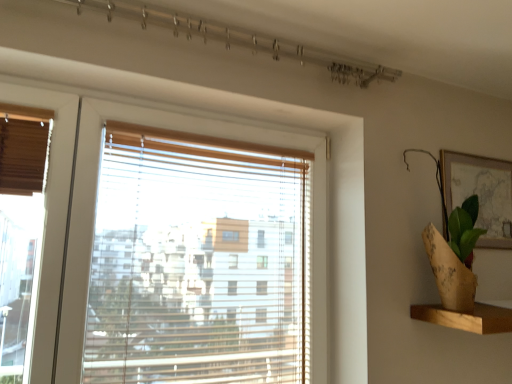
What do you see at coordinates (457, 219) in the screenshot?
I see `burlap wrapped plant at right` at bounding box center [457, 219].

What do you see at coordinates (313, 224) in the screenshot? I see `transparent plastic blinds at center` at bounding box center [313, 224].

Where is `transparent plastic blinds at center`? transparent plastic blinds at center is located at coordinates click(x=313, y=224).

Find the location of `wooden at right`. wooden at right is located at coordinates (468, 317).

Does matte gold picture frame at upper right turn towards wooden at right?

No.

Is the surface of matte gold picture frame at upper right in direct contact with wooden at right?

No, matte gold picture frame at upper right is not in contact with wooden at right.

Considering the sizes of objects matte gold picture frame at upper right and wooden at right in the image provided, who is bigger, matte gold picture frame at upper right or wooden at right?

Bigger between the two is wooden at right.

Which of these two, matte gold picture frame at upper right or wooden at right, is wider?

With larger width is wooden at right.

Is wooden at right further to the viewer compared to transparent plastic blinds at center?

Yes, wooden at right is further from the viewer.

Which is more to the left, wooden at right or transparent plastic blinds at center?

From the viewer's perspective, transparent plastic blinds at center appears more on the left side.

Considering the relative sizes of wooden at right and transparent plastic blinds at center in the image provided, is wooden at right smaller than transparent plastic blinds at center?

Yes, wooden at right is smaller than transparent plastic blinds at center.

Is burlap wrapped plant at right directly adjacent to wooden at right?

They are not placed beside each other.

Between point (475, 228) and point (457, 321), which one is positioned in front?

The point (457, 321) is more forward.

Considering the positions of objects burlap wrapped plant at right and wooden at right in the image provided, who is in front, burlap wrapped plant at right or wooden at right?

burlap wrapped plant at right.

How many degrees apart are the facing directions of burlap wrapped plant at right and wooden at right?

The angle between the facing direction of burlap wrapped plant at right and the facing direction of wooden at right is 0.0556 degrees.

Does transparent plastic blinds at center appear on the left side of wooden at right?

Yes, transparent plastic blinds at center is to the left of wooden at right.

Is transparent plastic blinds at center turned away from wooden at right?

No, transparent plastic blinds at center is not facing away from wooden at right.

Is the position of transparent plastic blinds at center more distant than that of wooden at right?

No, transparent plastic blinds at center is in front of wooden at right.

From a real-world perspective, who is located lower, transparent plastic blinds at center or wooden at right?

wooden at right.

Is matte gold picture frame at upper right far from transparent plastic blinds at center?

Actually, matte gold picture frame at upper right and transparent plastic blinds at center are a little close together.

Choose the correct answer: Is matte gold picture frame at upper right inside transparent plastic blinds at center or outside it?

The correct answer is: outside.

Considering the sizes of objects matte gold picture frame at upper right and transparent plastic blinds at center in the image provided, who is taller, matte gold picture frame at upper right or transparent plastic blinds at center?

With more height is transparent plastic blinds at center.

From a real-world perspective, between transparent plastic blinds at center and matte gold picture frame at upper right, who is vertically lower?

transparent plastic blinds at center.

Which is closer, (86, 253) or (475, 159)?

Point (86, 253) is positioned closer to the camera compared to point (475, 159).

How much distance is there between transparent plastic blinds at center and matte gold picture frame at upper right?

A distance of 27.99 inches exists between transparent plastic blinds at center and matte gold picture frame at upper right.

Where is `picture frame that appears above the transparent plastic blinds at center (from the image's perspective)`? The image size is (512, 384). picture frame that appears above the transparent plastic blinds at center (from the image's perspective) is located at coordinates coord(481,193).

Between burlap wrapped plant at right and matte gold picture frame at upper right, which one appears on the left side from the viewer's perspective?

From the viewer's perspective, burlap wrapped plant at right appears more on the left side.

Considering their positions, is burlap wrapped plant at right located in front of or behind matte gold picture frame at upper right?

Visually, burlap wrapped plant at right is located in front of matte gold picture frame at upper right.

Which is closer, (452,221) or (449,179)?

Point (452,221).

Based on the photo, from a real-world perspective, who is located higher, burlap wrapped plant at right or matte gold picture frame at upper right?

matte gold picture frame at upper right.

Where is `shelf on the left of the matte gold picture frame at upper right`? shelf on the left of the matte gold picture frame at upper right is located at coordinates (468, 317).

Locate an element on the screen. The image size is (512, 384). shelf below the transparent plastic blinds at center (from the image's perspective) is located at coordinates (468, 317).

Which object lies nearer to the anchor point wooden at right, burlap wrapped plant at right or transparent plastic blinds at center?

Based on the image, burlap wrapped plant at right appears to be nearer to wooden at right.

Looking at the image, which one is located further to wooden at right, transparent plastic blinds at center or matte gold picture frame at upper right?

transparent plastic blinds at center lies further to wooden at right than the other object.

From the image, which object appears to be nearer to matte gold picture frame at upper right, wooden at right or transparent plastic blinds at center?

wooden at right lies closer to matte gold picture frame at upper right than the other object.

From the picture: Which object lies nearer to the anchor point transparent plastic blinds at center, burlap wrapped plant at right or matte gold picture frame at upper right?

burlap wrapped plant at right lies closer to transparent plastic blinds at center than the other object.

From the image, which object appears to be farther from transparent plastic blinds at center, wooden at right or matte gold picture frame at upper right?

Based on the image, matte gold picture frame at upper right appears to be further to transparent plastic blinds at center.

Looking at this image, when comparing their distances from matte gold picture frame at upper right, does burlap wrapped plant at right or transparent plastic blinds at center seem further?

Among the two, transparent plastic blinds at center is located further to matte gold picture frame at upper right.

When comparing their distances from burlap wrapped plant at right, does matte gold picture frame at upper right or transparent plastic blinds at center seem further?

Among the two, transparent plastic blinds at center is located further to burlap wrapped plant at right.

Which object lies further to the anchor point burlap wrapped plant at right, wooden at right or transparent plastic blinds at center?

Based on the image, transparent plastic blinds at center appears to be further to burlap wrapped plant at right.

Identify the location of shelf between transparent plastic blinds at center and matte gold picture frame at upper right from left to right. This screenshot has width=512, height=384. (468, 317).

The image size is (512, 384). Find the location of `plant between transparent plastic blinds at center and wooden at right from left to right`. plant between transparent plastic blinds at center and wooden at right from left to right is located at coordinates (457, 219).

This screenshot has width=512, height=384. Identify the location of plant between transparent plastic blinds at center and matte gold picture frame at upper right in the horizontal direction. (457, 219).

At what (x,y) coordinates should I click in order to perform the action: click on shelf positioned between burlap wrapped plant at right and matte gold picture frame at upper right from near to far. Please return your answer as a coordinate pair (x, y). Looking at the image, I should click on (468, 317).